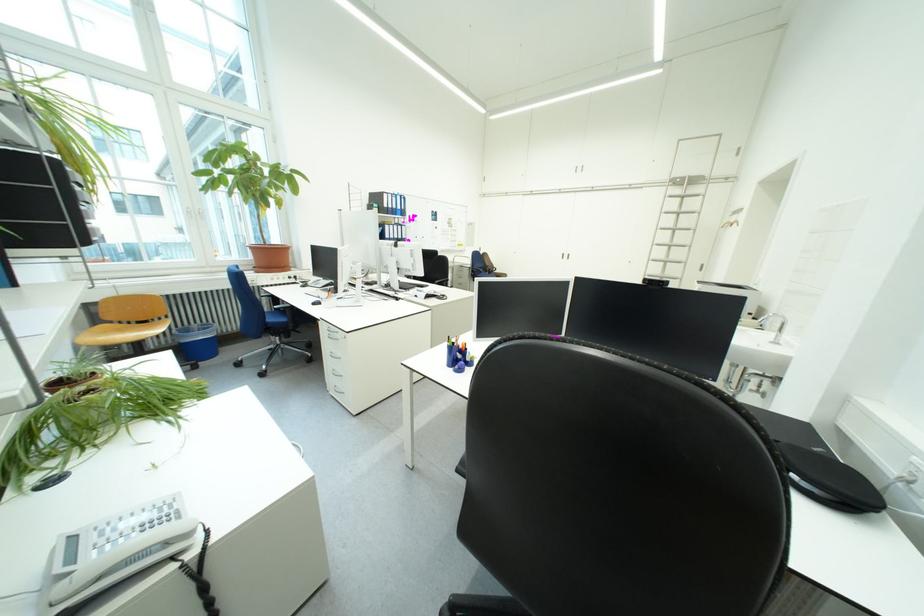
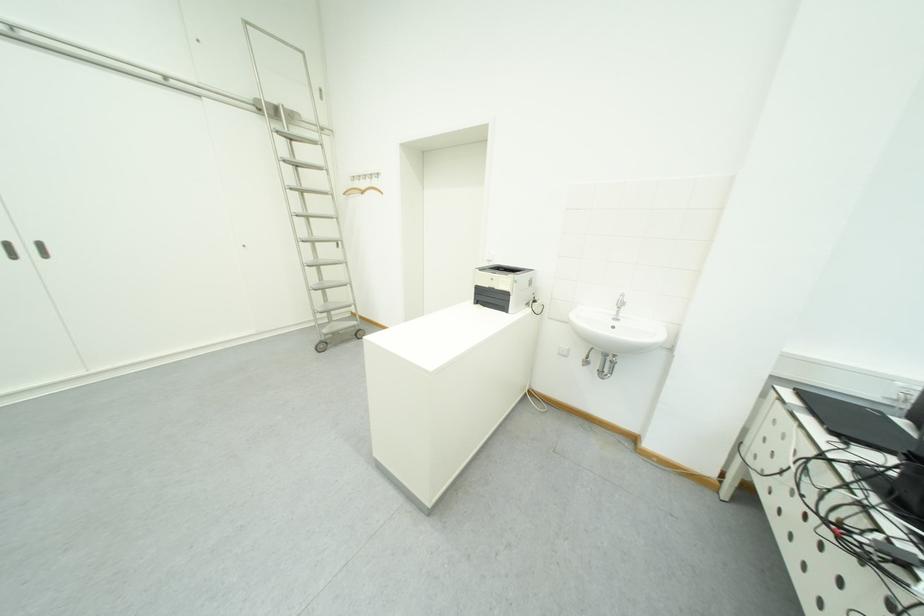
The point at (687, 244) is marked in the first image. Where is the corresponding point in the second image?

(322, 213)